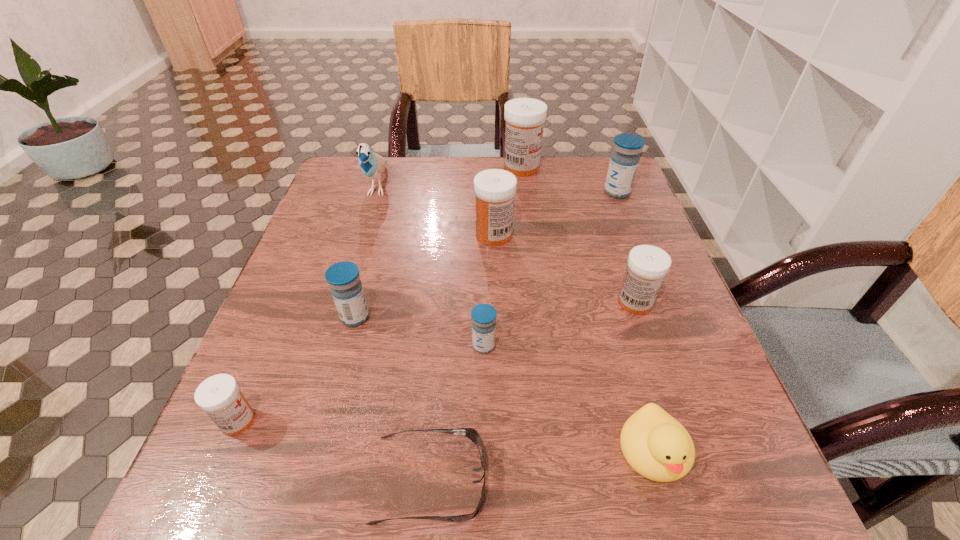
Find the location of a particular element. This screenshot has width=960, height=540. the biggest white medicine is located at coordinates (525, 117).

The width and height of the screenshot is (960, 540). What are the coordinates of `the farthest medicine` in the screenshot? It's located at (525, 117).

The image size is (960, 540). I want to click on bird, so coord(372,165).

At what (x,y) coordinates should I click in order to perform the action: click on the farthest blue medicine. Please return your answer as a coordinate pair (x, y). Looking at the image, I should click on (624, 161).

I want to click on the rightmost blue medicine, so click(x=624, y=161).

Locate an element on the screen. The height and width of the screenshot is (540, 960). the fourth farthest object is located at coordinates (495, 189).

Locate an element on the screen. the second farthest white medicine is located at coordinates (495, 189).

This screenshot has height=540, width=960. I want to click on the third farthest white medicine, so click(647, 265).

Where is `the rightmost white medicine`? This screenshot has height=540, width=960. the rightmost white medicine is located at coordinates (647, 265).

At what (x,y) coordinates should I click in order to perform the action: click on the second farthest blue medicine. Please return your answer as a coordinate pair (x, y). Image resolution: width=960 pixels, height=540 pixels. Looking at the image, I should click on (343, 277).